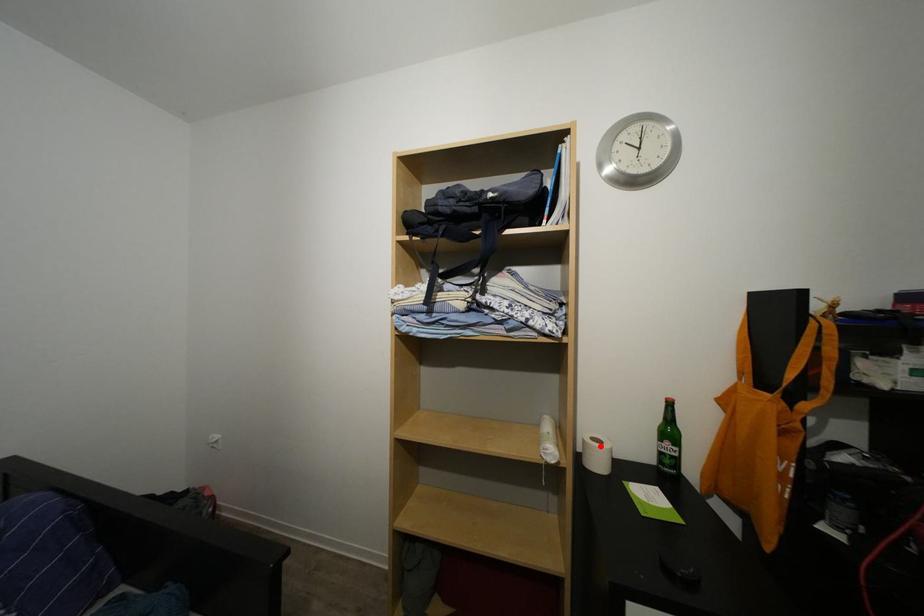
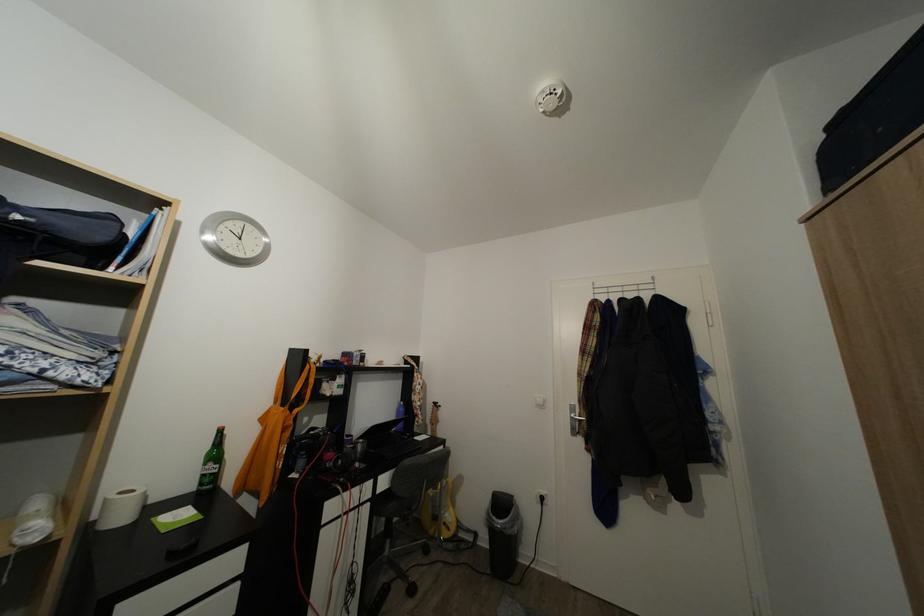
In the second image, find the point that corresponds to the highlighted location in the first image.

(129, 500)